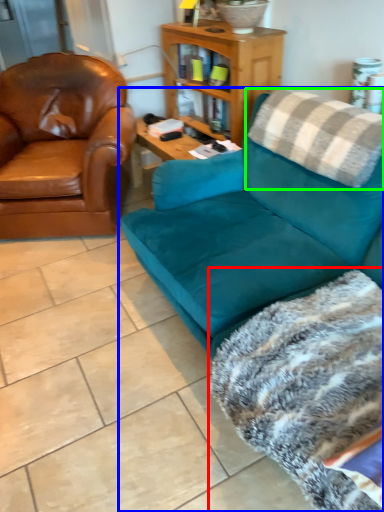
Question: Which object is the farthest from blanket (highlighted by a red box)? Choose among these: studio couch (highlighted by a blue box) or pillow (highlighted by a green box).

Choices:
 (A) studio couch
 (B) pillow

Answer: (B)